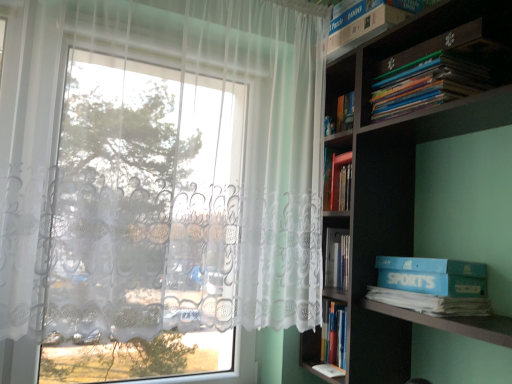
Question: Can you confirm if white lace curtain at left is shorter than blue cardboard box at right?

Choices:
 (A) no
 (B) yes

Answer: (A)

Question: Is white lace curtain at left positioned before blue cardboard box at right?

Choices:
 (A) yes
 (B) no

Answer: (A)

Question: Does white lace curtain at left appear on the left side of blue cardboard box at right?

Choices:
 (A) yes
 (B) no

Answer: (A)

Question: Would you consider white lace curtain at left to be distant from blue cardboard box at right?

Choices:
 (A) no
 (B) yes

Answer: (A)

Question: Is blue cardboard box at right surrounded by white lace curtain at left?

Choices:
 (A) no
 (B) yes

Answer: (A)

Question: Does point (377, 31) appear closer or farther from the camera than point (457, 281)?

Choices:
 (A) closer
 (B) farther

Answer: (B)

Question: Relative to blue cardboard box at right, is white cardboard box at upper right, which is counted as the 1th book, starting from the top, in front or behind?

Choices:
 (A) behind
 (B) front

Answer: (A)

Question: Is white cardboard box at upper right, which appears as the 2th book when ordered from the bottom, spatially inside blue cardboard box at right, or outside of it?

Choices:
 (A) outside
 (B) inside

Answer: (A)

Question: Considering the positions of white cardboard box at upper right, which appears as the 2th book when ordered from the bottom, and blue cardboard box at right in the image, is white cardboard box at upper right, which appears as the 2th book when ordered from the bottom, bigger or smaller than blue cardboard box at right?

Choices:
 (A) small
 (B) big

Answer: (B)

Question: Is white cardboard box at upper right, which appears as the 2th book when ordered from the bottom, bigger or smaller than white lace curtain at left?

Choices:
 (A) big
 (B) small

Answer: (B)

Question: In terms of height, does white cardboard box at upper right, which appears as the 2th book when ordered from the bottom, look taller or shorter compared to white lace curtain at left?

Choices:
 (A) short
 (B) tall

Answer: (A)

Question: From the image's perspective, is white cardboard box at upper right, which is counted as the 1th book, starting from the top, located above or below white lace curtain at left?

Choices:
 (A) below
 (B) above

Answer: (B)

Question: Is white cardboard box at upper right, which is counted as the 1th book, starting from the top, inside or outside of white lace curtain at left?

Choices:
 (A) outside
 (B) inside

Answer: (A)

Question: From a real-world perspective, is wooden bookshelf at upper right physically located above or below blue cardboard box at right?

Choices:
 (A) above
 (B) below

Answer: (A)

Question: Considering the relative positions of wooden bookshelf at upper right and blue cardboard box at right in the image provided, is wooden bookshelf at upper right to the left or to the right of blue cardboard box at right?

Choices:
 (A) right
 (B) left

Answer: (A)